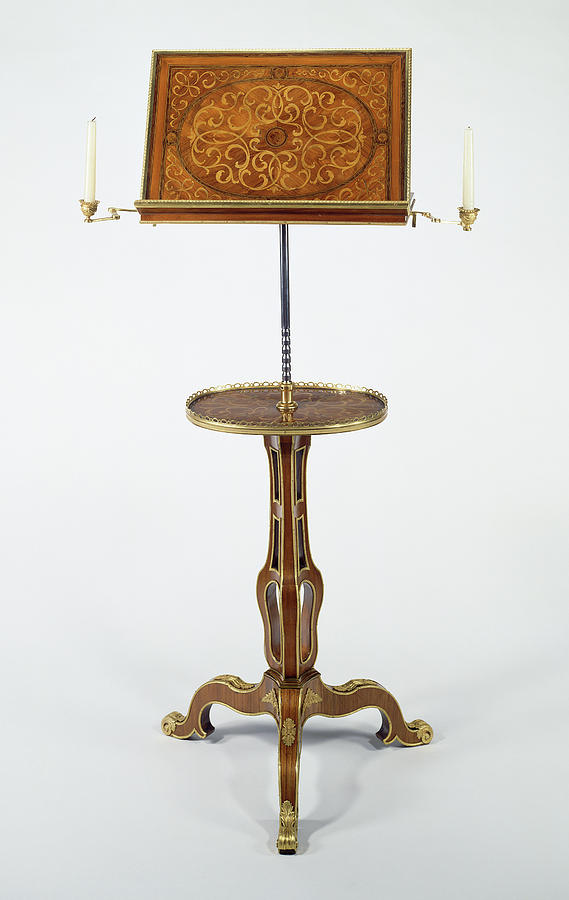
You are a GUI agent. You are given a task and a screenshot of the screen. Output one action in this format:
    pyautogui.click(x=<x>, y=<y>)
    Task: Click on the for placing books
    The image size is (569, 900).
    Given the screenshot: What is the action you would take?
    point(259,194)